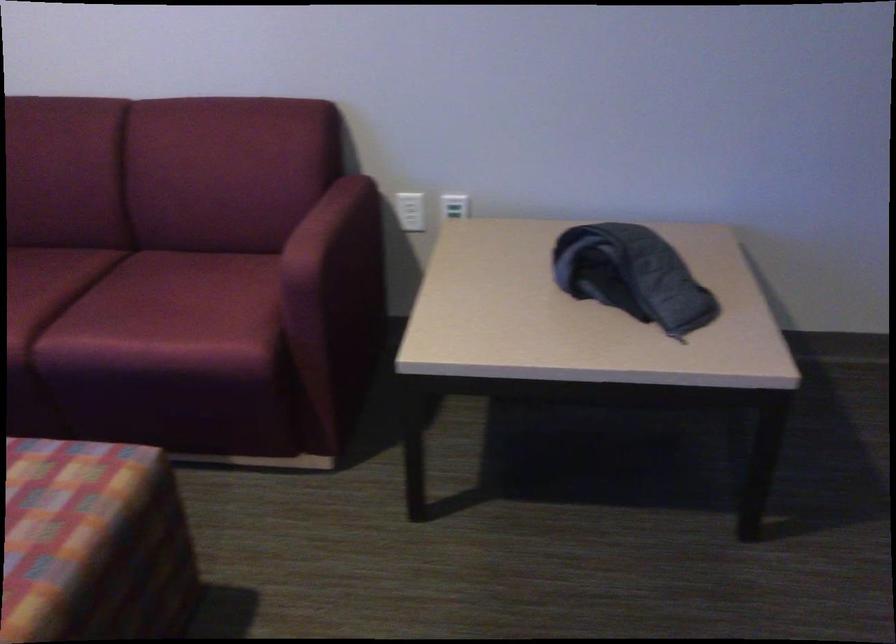
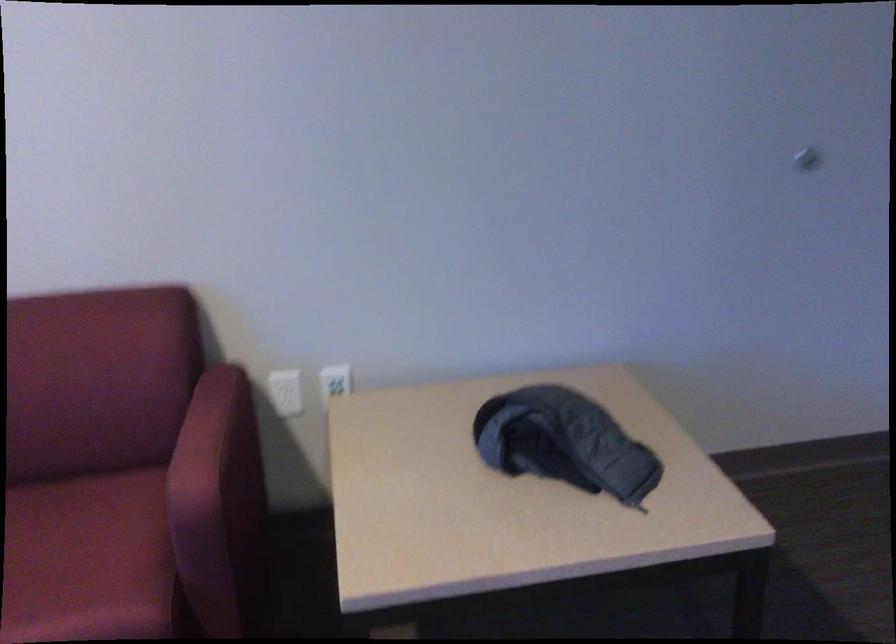
In the second image, find the point that corresponds to (x=307, y=272) in the first image.

(204, 504)